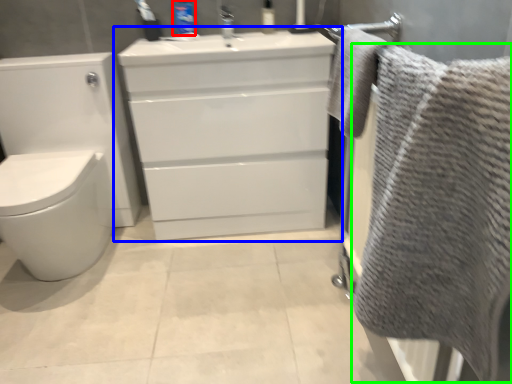
Question: Which object is positioned farthest from toiletry (highlighted by a red box)? Select from bathroom cabinet (highlighted by a blue box) and bath towel (highlighted by a green box).

Choices:
 (A) bathroom cabinet
 (B) bath towel

Answer: (B)